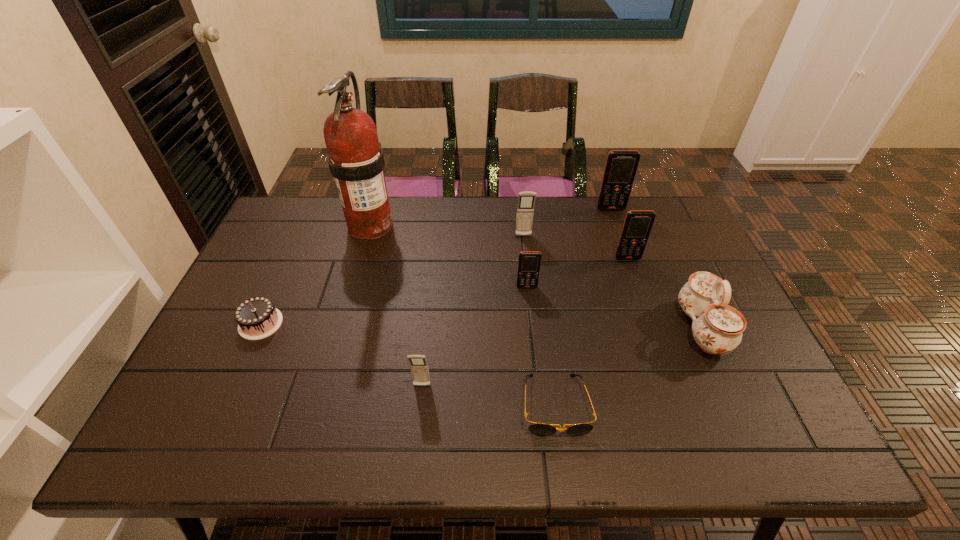
This screenshot has width=960, height=540. I want to click on the fourth closest cellular telephone to the black sunglasses, so click(x=526, y=200).

In order to click on orange cellular telephone that stands as the second closest to the white chinaware in this screenshot , I will do `click(529, 262)`.

At what (x,y) coordinates should I click in order to perform the action: click on orange cellular telephone identified as the second closest to the leftmost object. Please return your answer as a coordinate pair (x, y). This screenshot has width=960, height=540. Looking at the image, I should click on (637, 226).

Identify the location of vacant area that satisfies the following two spatial constraints: 1. by the handle of the rightmost object; 2. on the lenses of the sunglasses. (736, 405).